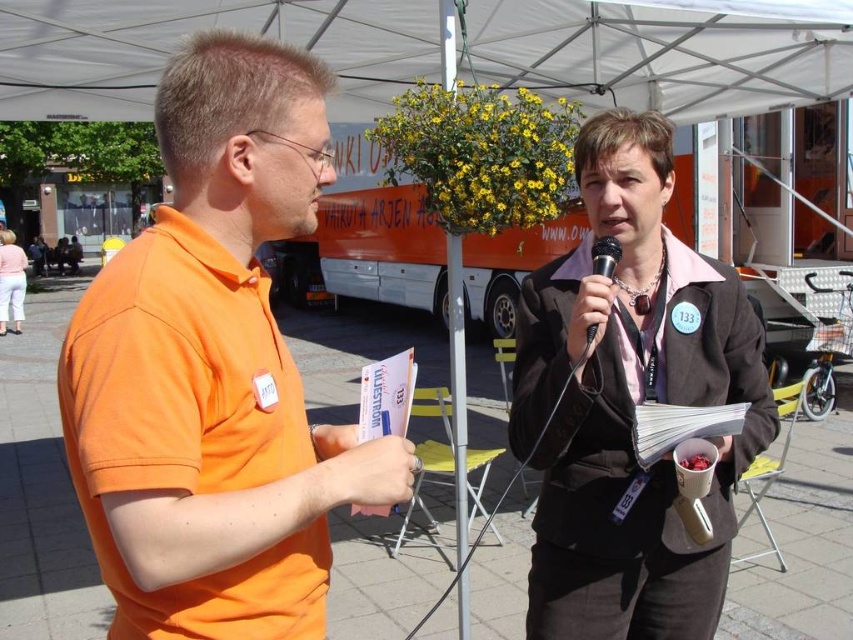
Question: Considering the relative positions of matte black blazer at center and white fabric canopy at upper center in the image provided, where is matte black blazer at center located with respect to white fabric canopy at upper center?

Choices:
 (A) left
 (B) right

Answer: (B)

Question: Which point is closer to the camera?

Choices:
 (A) matte pink shirt at lower left
 (B) white fabric canopy at upper center

Answer: (B)

Question: Where is matte black blazer at center located in relation to black metallic microphone at center in the image?

Choices:
 (A) right
 (B) left

Answer: (A)

Question: Which point is closer to the camera taking this photo?

Choices:
 (A) (601, 252)
 (B) (509, 61)

Answer: (A)

Question: Which point is farther from the camera taking this photo?

Choices:
 (A) (0, 328)
 (B) (180, 528)

Answer: (A)

Question: Where is matte black blazer at center located in relation to black metallic microphone at center in the image?

Choices:
 (A) right
 (B) left

Answer: (A)